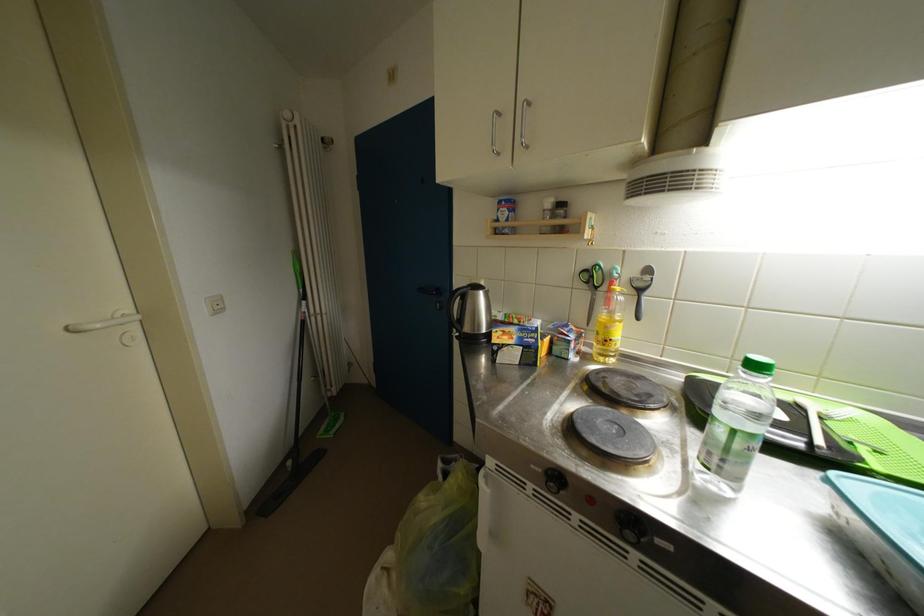
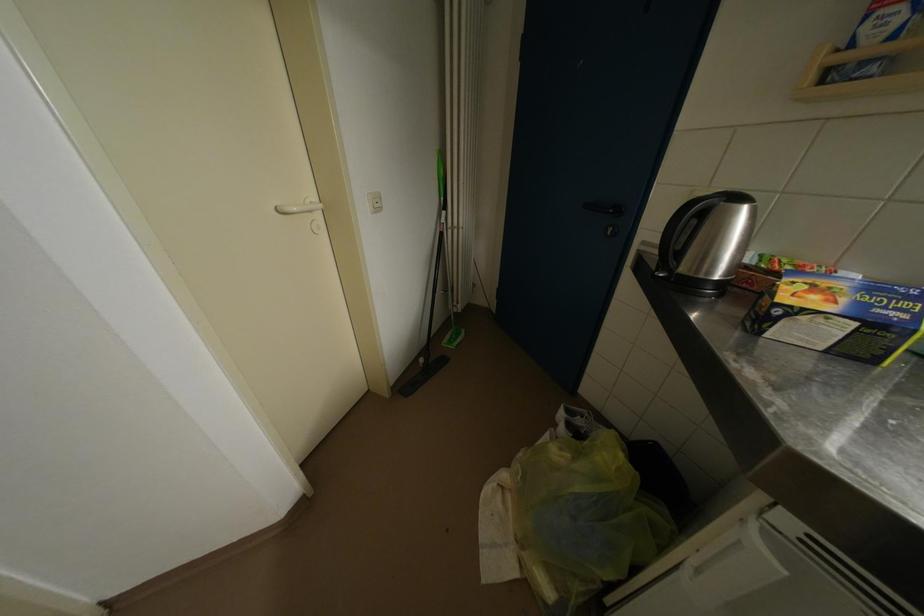
Where in the second image is the point corresponding to point 502,344 from the first image?

(791, 302)